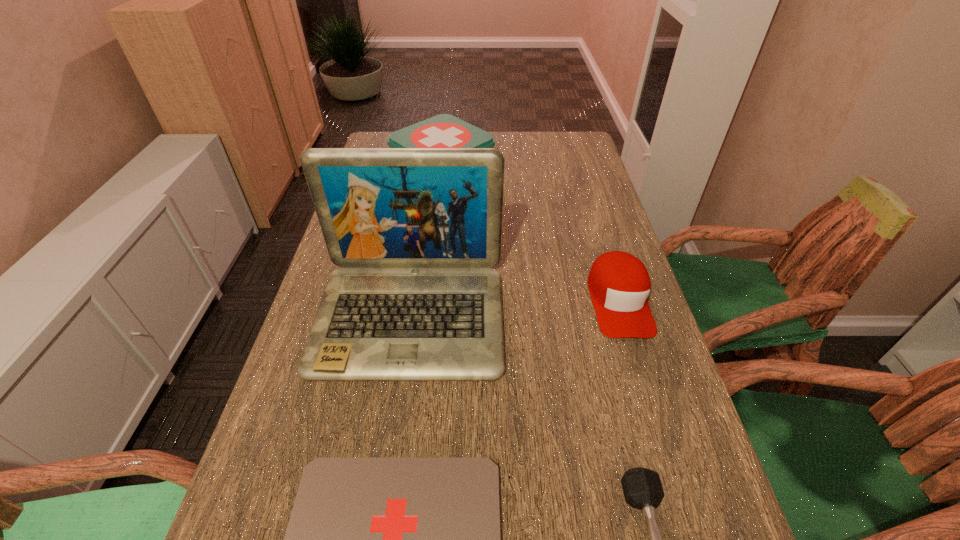
Where is `object located at the right edge`? object located at the right edge is located at coordinates (619, 284).

Find the location of a particular element. object that is at the far left corner is located at coordinates (444, 130).

Locate an element on the screen. This screenshot has height=540, width=960. vacant space at the far edge of the desktop is located at coordinates (534, 156).

This screenshot has width=960, height=540. What are the coordinates of `vacant position at the left edge of the desktop` in the screenshot? It's located at (277, 412).

Image resolution: width=960 pixels, height=540 pixels. In order to click on vacant space at the right edge of the desktop in this screenshot , I will do `click(582, 328)`.

This screenshot has width=960, height=540. I want to click on free space at the far right corner of the desktop, so click(581, 134).

The height and width of the screenshot is (540, 960). I want to click on vacant space that's between the farthest object and the third tallest object, so click(x=531, y=234).

Identify the location of object that is the fourth closest one to the shorter first-aid kit. The image size is (960, 540). (444, 130).

Identify the location of object identified as the second closest to the nearer first-aid kit. (642, 488).